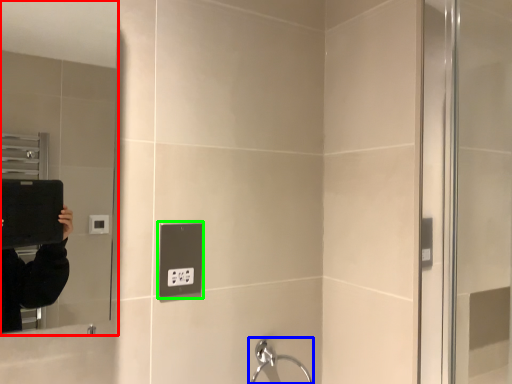
Question: Which object is positioned closest to mirror (highlighted by a red box)? Select from faucet (highlighted by a blue box) and electric outlet (highlighted by a green box).

Choices:
 (A) faucet
 (B) electric outlet

Answer: (B)